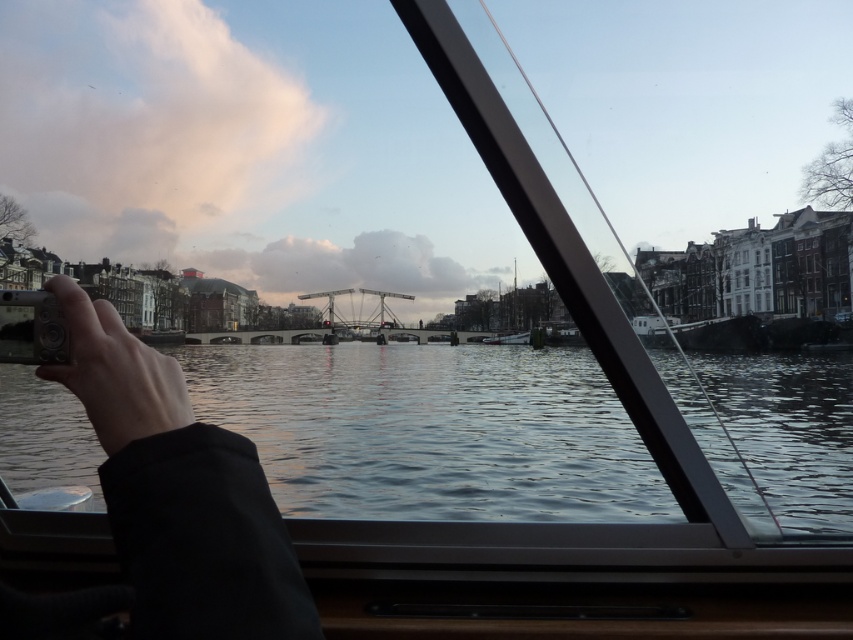
From the picture: Is metallic silver camera at lower left wider than matte black camera at lower left?

In fact, metallic silver camera at lower left might be narrower than matte black camera at lower left.

Image resolution: width=853 pixels, height=640 pixels. What do you see at coordinates (167, 502) in the screenshot? I see `metallic silver camera at lower left` at bounding box center [167, 502].

Image resolution: width=853 pixels, height=640 pixels. What do you see at coordinates (167, 502) in the screenshot?
I see `metallic silver camera at lower left` at bounding box center [167, 502].

Identify the location of metallic silver camera at lower left. Image resolution: width=853 pixels, height=640 pixels. (167, 502).

Which of these two, glossy water at center or matte black camera at lower left, stands taller?

Standing taller between the two is glossy water at center.

Between glossy water at center and matte black camera at lower left, which one is positioned lower?

glossy water at center is lower down.

Does point (368, 438) come behind point (91, 412)?

Yes.

Identify the location of glossy water at center. pos(431,429).

Does glossy water at center appear on the left side of metallic silver camera at lower left?

Yes, glossy water at center is to the left of metallic silver camera at lower left.

Is point (328, 438) positioned behind point (148, 358)?

Yes, point (328, 438) is farther from viewer.

I want to click on glossy water at center, so click(431, 429).